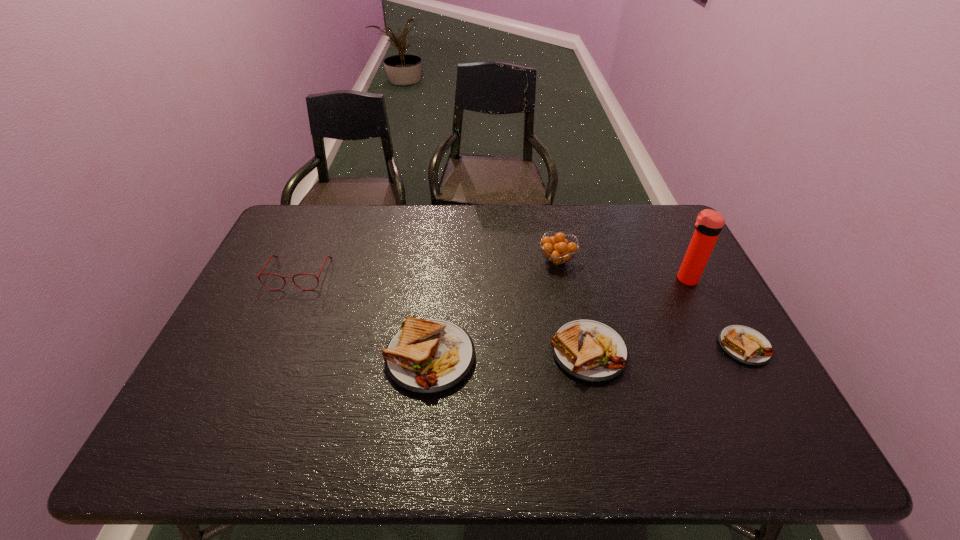
Where is `the leftmost sandwich`? The width and height of the screenshot is (960, 540). the leftmost sandwich is located at coordinates (426, 356).

Where is `the second shortest object`? the second shortest object is located at coordinates tap(589, 350).

The image size is (960, 540). What are the coordinates of `the second sandwich from right to left` in the screenshot? It's located at (589, 350).

Image resolution: width=960 pixels, height=540 pixels. I want to click on the shortest sandwich, so [x=746, y=345].

Where is `the rightmost sandwich`? This screenshot has width=960, height=540. the rightmost sandwich is located at coordinates (746, 345).

At what (x,y) coordinates should I click in order to perform the action: click on the leftmost object. Please return your answer as a coordinate pair (x, y). Looking at the image, I should click on (271, 256).

Identify the location of orange fruit. Image resolution: width=960 pixels, height=540 pixels. (558, 249).

You are a GUI agent. You are given a task and a screenshot of the screen. Output one action in this format:
    pyautogui.click(x=<x>, y=<y>)
    Task: Click on the tallest object
    
    Given the screenshot: What is the action you would take?
    pyautogui.click(x=709, y=223)

Where is `vacant area situated 0.240m on the right of the second object from left to right`? vacant area situated 0.240m on the right of the second object from left to right is located at coordinates (570, 357).

Find the location of a particular element. The width and height of the screenshot is (960, 540). vacant space positioned 0.330m on the back of the fifth tallest object is located at coordinates (565, 246).